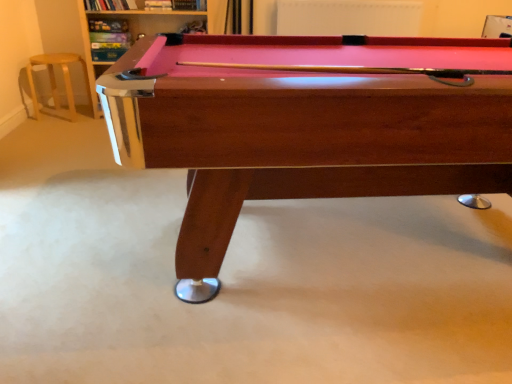
Question: From the image's perspective, is metallic silver pool table at upper left under wooden billiard table at center?

Choices:
 (A) no
 (B) yes

Answer: (A)

Question: Is metallic silver pool table at upper left smaller than wooden billiard table at center?

Choices:
 (A) yes
 (B) no

Answer: (A)

Question: Can you confirm if metallic silver pool table at upper left is thinner than wooden billiard table at center?

Choices:
 (A) yes
 (B) no

Answer: (A)

Question: Is metallic silver pool table at upper left oriented away from wooden billiard table at center?

Choices:
 (A) no
 (B) yes

Answer: (A)

Question: Is metallic silver pool table at upper left at the left side of wooden billiard table at center?

Choices:
 (A) no
 (B) yes

Answer: (B)

Question: Considering the positions of wooden billiard table at center and metallic silver pool table at upper left in the image, is wooden billiard table at center bigger or smaller than metallic silver pool table at upper left?

Choices:
 (A) big
 (B) small

Answer: (A)

Question: Considering the positions of point (332, 127) and point (134, 34), is point (332, 127) closer or farther from the camera than point (134, 34)?

Choices:
 (A) farther
 (B) closer

Answer: (B)

Question: Is wooden billiard table at center in front of or behind metallic silver pool table at upper left in the image?

Choices:
 (A) front
 (B) behind

Answer: (A)

Question: Based on their positions, is wooden billiard table at center located to the left or right of metallic silver pool table at upper left?

Choices:
 (A) right
 (B) left

Answer: (A)

Question: Visually, is metallic silver pool table at upper left positioned to the left or to the right of light wood bar stool at left?

Choices:
 (A) right
 (B) left

Answer: (A)

Question: From a real-world perspective, is metallic silver pool table at upper left positioned above or below light wood bar stool at left?

Choices:
 (A) below
 (B) above

Answer: (B)

Question: Considering the positions of metallic silver pool table at upper left and light wood bar stool at left in the image, is metallic silver pool table at upper left wider or thinner than light wood bar stool at left?

Choices:
 (A) wide
 (B) thin

Answer: (B)

Question: Considering the positions of point (91, 77) and point (70, 97), is point (91, 77) closer or farther from the camera than point (70, 97)?

Choices:
 (A) closer
 (B) farther

Answer: (A)

Question: From a real-world perspective, is metallic silver pool table at upper left physically located above or below wooden billiard table at center?

Choices:
 (A) below
 (B) above

Answer: (B)

Question: In terms of width, does metallic silver pool table at upper left look wider or thinner when compared to wooden billiard table at center?

Choices:
 (A) wide
 (B) thin

Answer: (B)